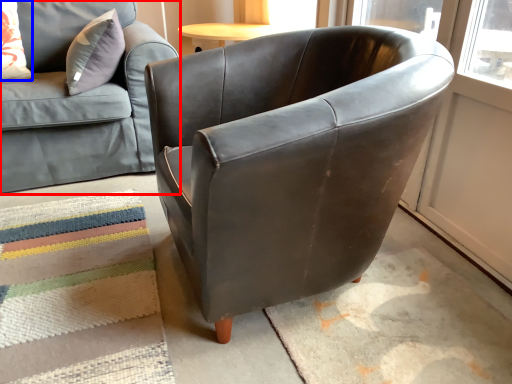
Question: Which object is closer to the camera taking this photo, studio couch (highlighted by a red box) or pillow (highlighted by a blue box)?

Choices:
 (A) studio couch
 (B) pillow

Answer: (A)